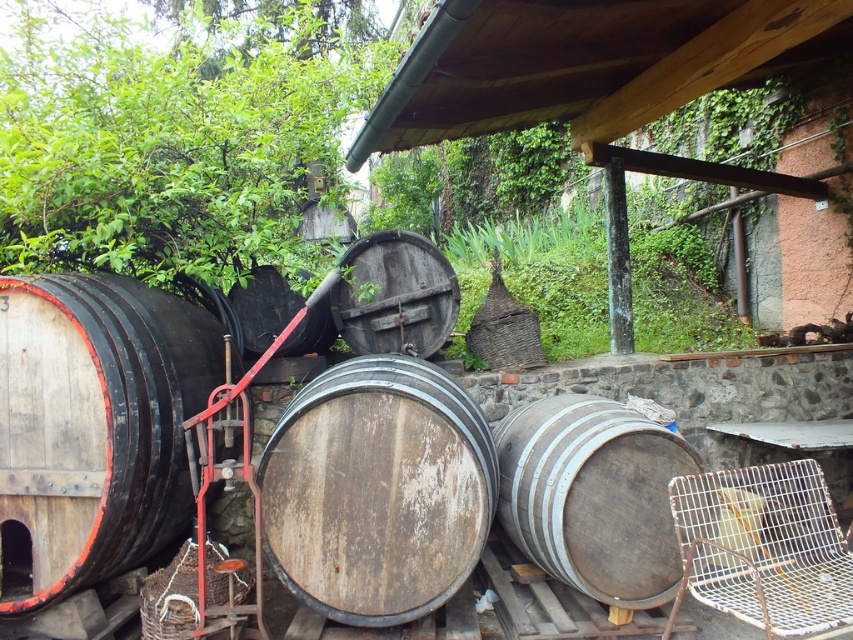
Question: Considering the real-world distances, which object is farthest from the gray wooden barrel at center?

Choices:
 (A) dark brown wooden barrel at center
 (B) wooden barrel at left
 (C) rusty wire chair at lower right

Answer: (B)

Question: Which point is farther to the camera?

Choices:
 (A) rusty wire chair at lower right
 (B) wooden barrel at left
 (C) gray wooden barrel at center
 (D) wooden barrel at center

Answer: (D)

Question: Which point is closer to the camera?

Choices:
 (A) (538, 525)
 (B) (347, 276)
 (C) (741, 529)
 (D) (343, 436)

Answer: (D)

Question: Can you confirm if weathered wood barrel at center is positioned above gray wooden barrel at center?

Choices:
 (A) yes
 (B) no

Answer: (B)

Question: Is gray wooden barrel at center to the right of rusty wire chair at lower right from the viewer's perspective?

Choices:
 (A) yes
 (B) no

Answer: (B)

Question: Can you confirm if weathered wood barrel at center is smaller than rusty wire chair at lower right?

Choices:
 (A) no
 (B) yes

Answer: (B)